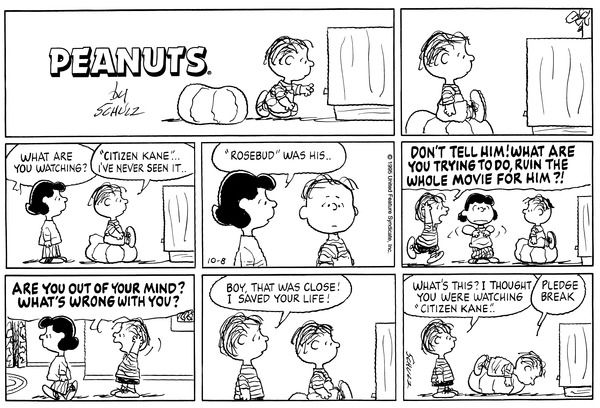
What are the coordinates of `tv` in the screenshot? It's located at (368, 82), (544, 84), (182, 221), (588, 222), (387, 364), (571, 364).